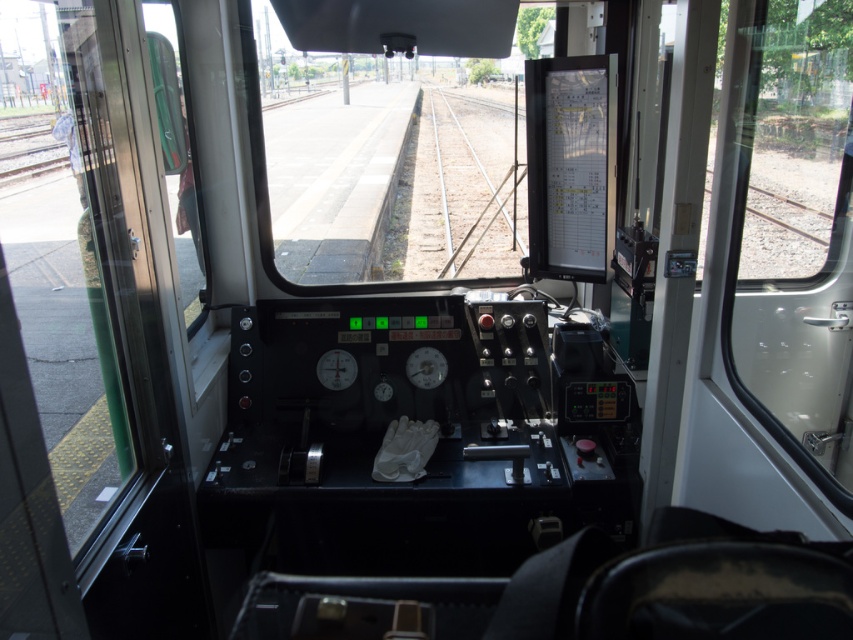
Looking at this image, does transparent glass window at right have a greater height compared to metallic silver train track at center?

In fact, transparent glass window at right may be shorter than metallic silver train track at center.

Based on the photo, who is taller, transparent glass window at right or metallic silver train track at center?

metallic silver train track at center

Based on the photo, measure the distance between point (718, 141) and camera.

Point (718, 141) is 5.66 feet from camera.

The image size is (853, 640). Identify the location of transparent glass window at right. (790, 228).